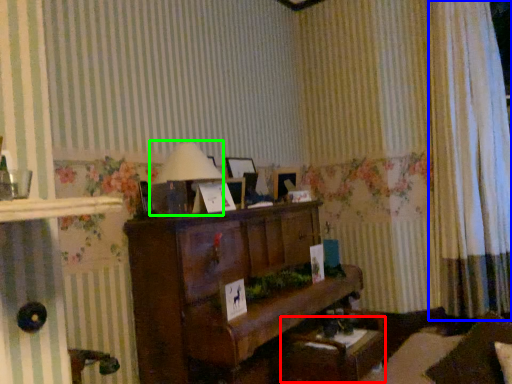
Question: Based on their relative distances, which object is nearer to table (highlighted by a red box)? Choose from curtain (highlighted by a blue box) and table lamp (highlighted by a green box).

Choices:
 (A) curtain
 (B) table lamp

Answer: (B)